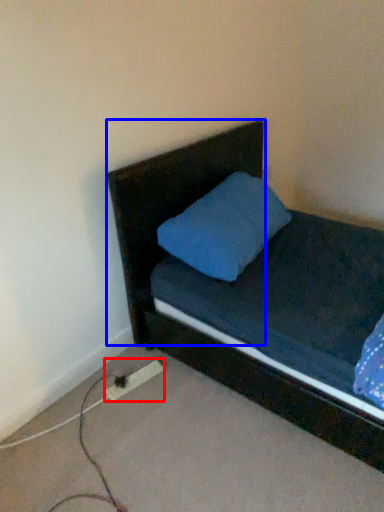
Question: Which object appears farthest to the camera in this image, extension cord (highlighted by a red box) or headboard (highlighted by a blue box)?

Choices:
 (A) extension cord
 (B) headboard

Answer: (A)